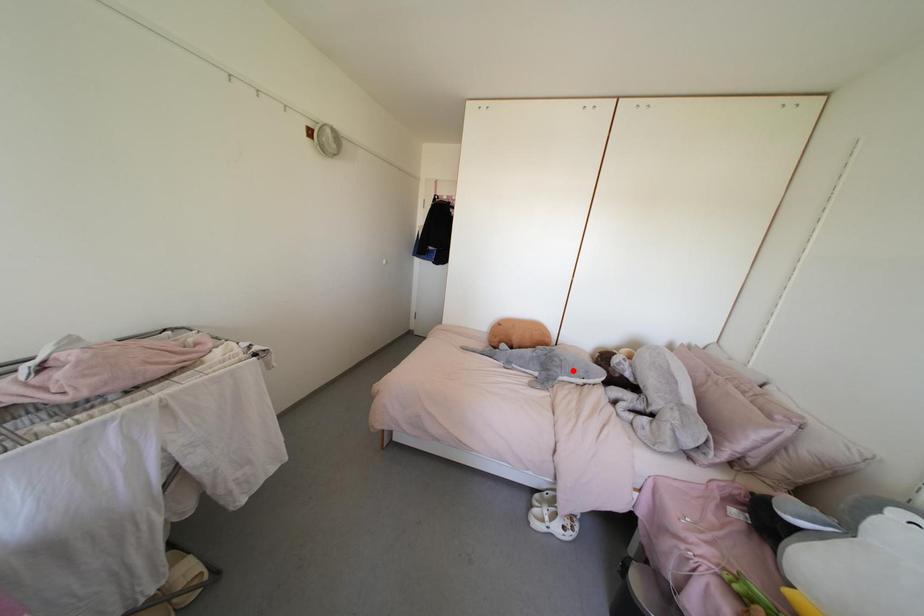
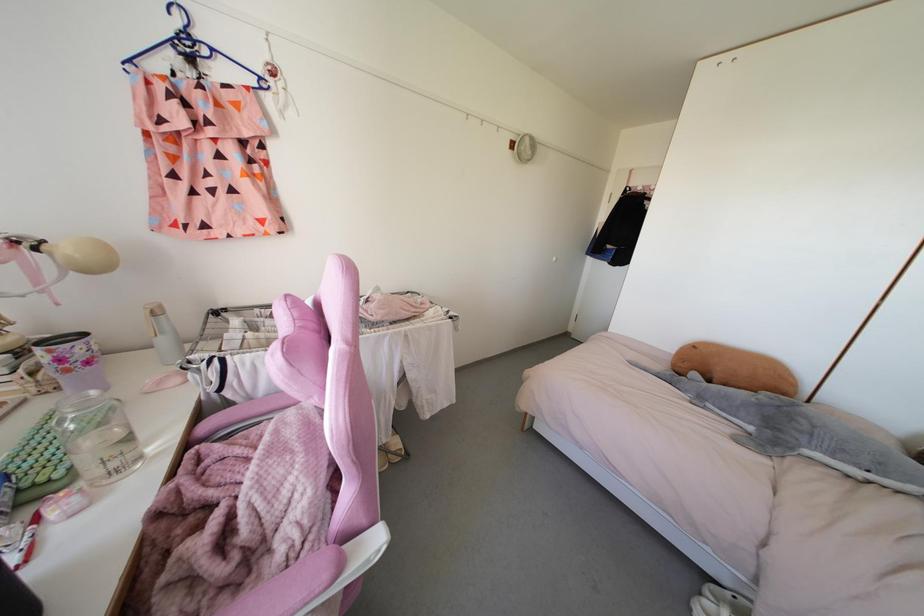
Locate, in the second image, the point that corresponds to the highlighted location in the first image.

(843, 450)